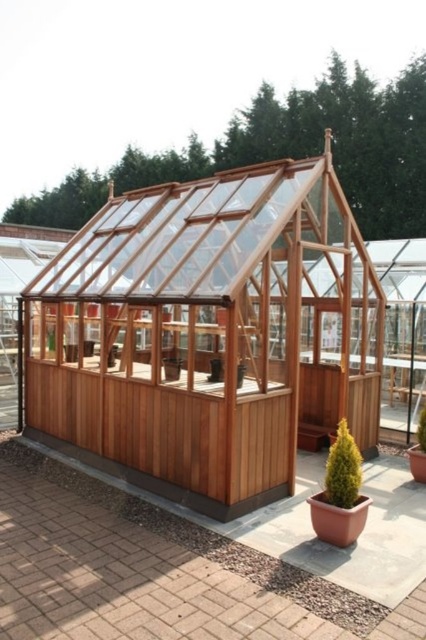
You are standing outside the greenhouse and see the green textured cone at lower right and the green matte potted plant at center. Which one is positioned more to the left side?

The green textured cone at lower right is positioned more to the left side than the green matte potted plant at center.